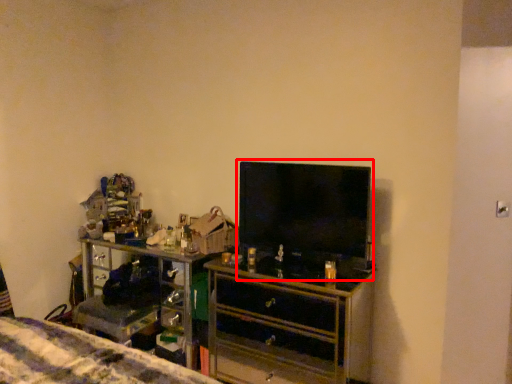
Question: Considering the relative positions of tv show (annotated by the red box) and chest of drawers in the image provided, where is tv show (annotated by the red box) located with respect to the staircase?

Choices:
 (A) right
 (B) left

Answer: (A)